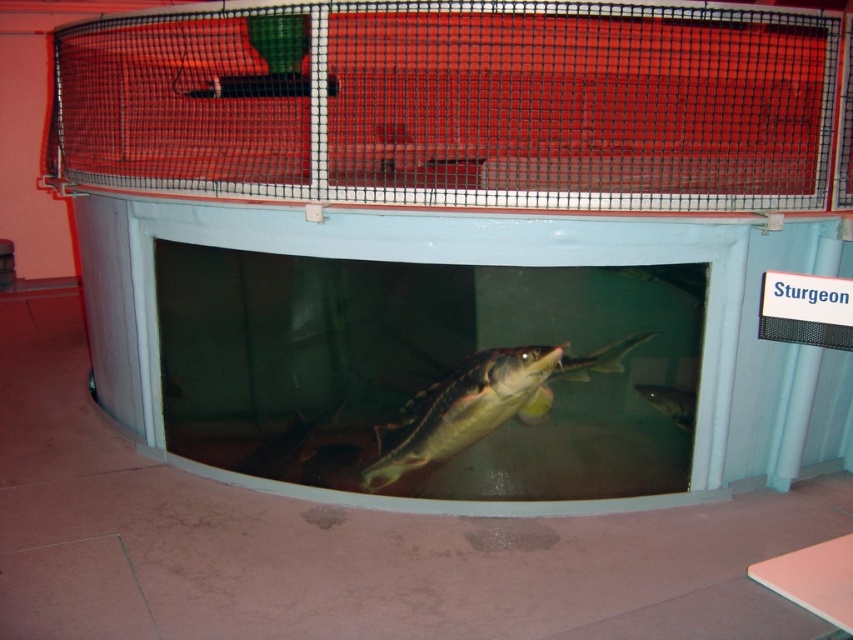
You are a visitor at the aquarium and want to take a photo of the shiny silver fish at center without the transparent plastic cage at upper center blocking the view. Is there a position where you can stand to achieve this?

Yes, since the transparent plastic cage at upper center is to the right of the shiny silver fish at center, you can position yourself to the left side of the tank to avoid the cage blocking the view of the shiny silver fish at center.